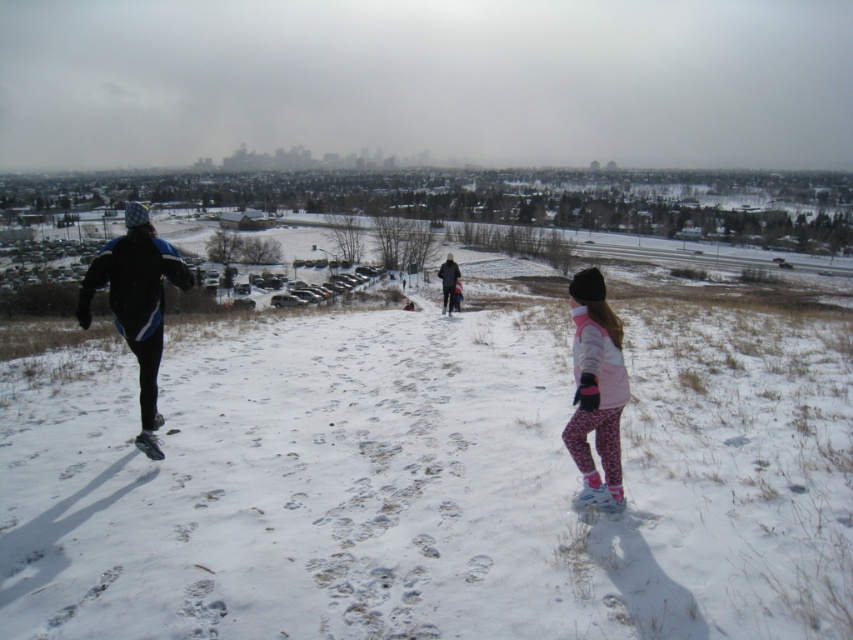
You are planning to take a shortcut through the snowy area. The white fluffy snow at center and the dark blue jacket at center are in your path. Which object is located higher up in the scene?

The white fluffy snow at center is positioned over the dark blue jacket at center, so it is higher up in the scene.

You are planning to take a photo of the two people in the snowy landscape. The photographer wants to ensure that both the pink fleece jacket at center and the dark blue jacket at center are clearly visible in the frame. Based on their positions, which jacket will appear closer to the bottom of the photo?

The pink fleece jacket at center is below the dark blue jacket at center, so it will appear closer to the bottom of the photo.

You are standing at the point with coordinates point (448,268) and want to walk towards the point with coordinates point (589,368). Which direction should you move to get closer to your destination?

Since point (589,368) is closer to the viewer than point (448,268), you should move forward towards the point (589,368) to get closer to your destination.